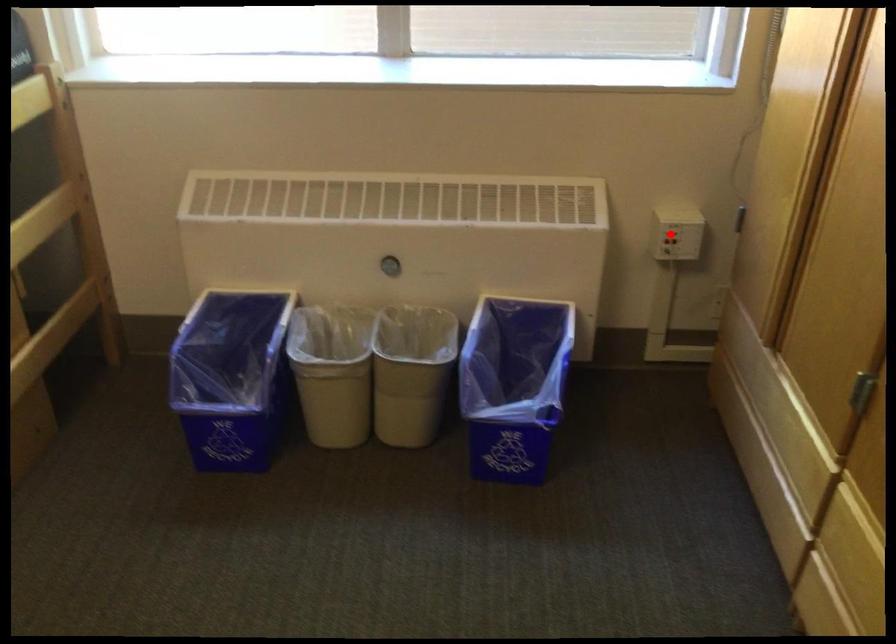
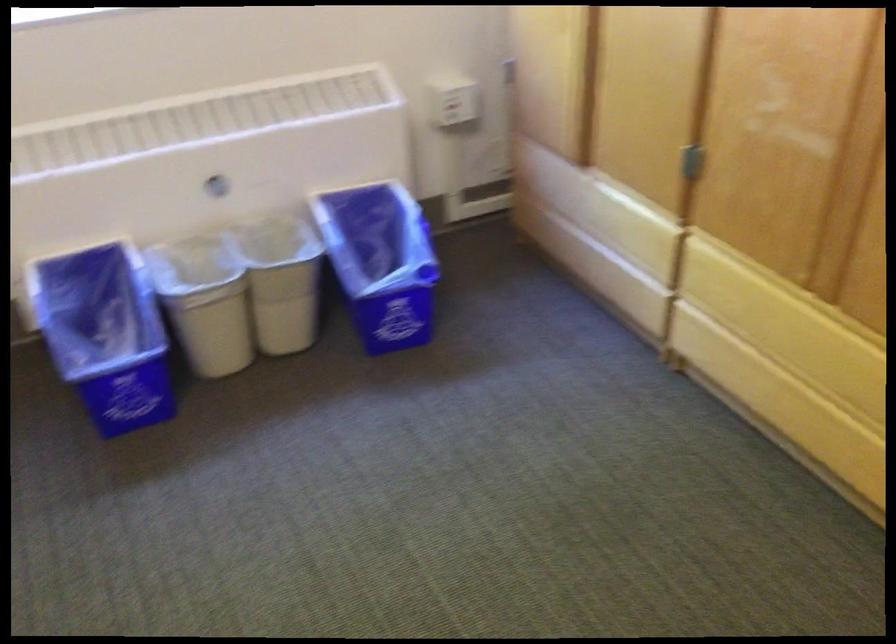
Where in the second image is the point corresponding to the highlighted location from the first image?

(452, 100)